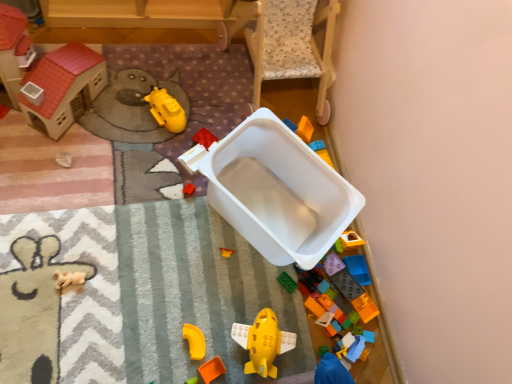
Question: Considering the relative positions of green matte toy at lower right, which is the fourth toy in right-to-left order, and bright orange plastic blocks at lower right, the first toy viewed from the right, in the image provided, is green matte toy at lower right, which is the fourth toy in right-to-left order, in front of bright orange plastic blocks at lower right, the first toy viewed from the right,?

Choices:
 (A) no
 (B) yes

Answer: (B)

Question: Is the surface of green matte toy at lower right, which is the fourth toy in right-to-left order, in direct contact with bright orange plastic blocks at lower right, the first toy viewed from the right?

Choices:
 (A) yes
 (B) no

Answer: (B)

Question: Can you confirm if green matte toy at lower right, the eighth toy positioned from the left, is positioned to the left of bright orange plastic blocks at lower right, the first toy viewed from the right?

Choices:
 (A) yes
 (B) no

Answer: (A)

Question: Is green matte toy at lower right, the eighth toy positioned from the left, taller than bright orange plastic blocks at lower right, the first toy viewed from the right?

Choices:
 (A) yes
 (B) no

Answer: (B)

Question: Is green matte toy at lower right, which is the fourth toy in right-to-left order, shorter than bright orange plastic blocks at lower right, which is the eleventh toy from left to right?

Choices:
 (A) no
 (B) yes

Answer: (B)

Question: From a real-world perspective, relative to bright orange plastic blocks at lower right, which is the eleventh toy from left to right, is green matte toy at lower right, which is the fourth toy in right-to-left order, vertically above or below?

Choices:
 (A) below
 (B) above

Answer: (A)

Question: Considering the positions of green matte toy at lower right, the eighth toy positioned from the left, and bright orange plastic blocks at lower right, which is the eleventh toy from left to right, in the image, is green matte toy at lower right, the eighth toy positioned from the left, bigger or smaller than bright orange plastic blocks at lower right, which is the eleventh toy from left to right,?

Choices:
 (A) small
 (B) big

Answer: (A)

Question: Considering the positions of point (323, 354) and point (373, 304), is point (323, 354) closer or farther from the camera than point (373, 304)?

Choices:
 (A) closer
 (B) farther

Answer: (A)

Question: Is green matte toy at lower right, the eighth toy positioned from the left, taller or shorter than bright orange plastic blocks at lower right, the first toy viewed from the right?

Choices:
 (A) short
 (B) tall

Answer: (A)

Question: Would you say yellow plastic airplane at center, placed as the 7th toy when sorted from left to right, is to the left or to the right of white plastic container at center, which is the 3th toy in left-to-right order, in the picture?

Choices:
 (A) left
 (B) right

Answer: (B)

Question: In terms of height, does yellow plastic airplane at center, arranged as the fifth toy when viewed from the right, look taller or shorter compared to white plastic container at center, which is the 3th toy in left-to-right order?

Choices:
 (A) short
 (B) tall

Answer: (B)

Question: Is yellow plastic airplane at center, placed as the 7th toy when sorted from left to right, situated inside white plastic container at center, the 9th toy from the right, or outside?

Choices:
 (A) outside
 (B) inside

Answer: (A)

Question: From the image's perspective, relative to white plastic container at center, the 9th toy from the right, is yellow plastic airplane at center, placed as the 7th toy when sorted from left to right, above or below?

Choices:
 (A) above
 (B) below

Answer: (B)

Question: Considering the relative positions of matte plastic toy house at lower right, positioned as the 9th toy in left-to-right order, and green matte toy at lower right, which is the fourth toy in right-to-left order, in the image provided, is matte plastic toy house at lower right, positioned as the 9th toy in left-to-right order, to the left or to the right of green matte toy at lower right, which is the fourth toy in right-to-left order,?

Choices:
 (A) right
 (B) left

Answer: (A)

Question: Is matte plastic toy house at lower right, positioned as the 3th toy in right-to-left order, taller or shorter than green matte toy at lower right, which is the fourth toy in right-to-left order?

Choices:
 (A) short
 (B) tall

Answer: (B)